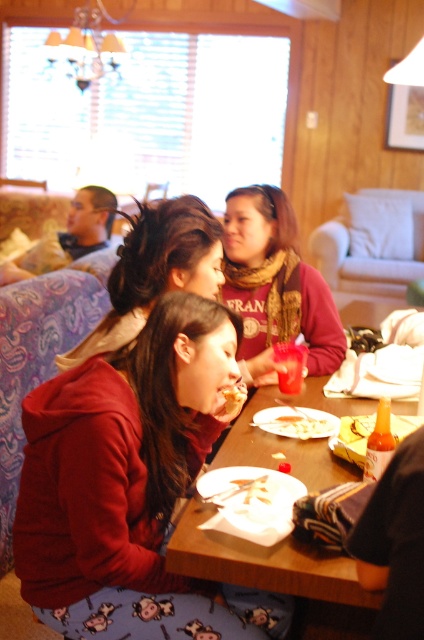
Is point (95, 614) less distant than point (281, 433)?

Yes, point (95, 614) is closer to viewer.

Does matte red hoodie at lower left appear on the right side of white matte pasta at table center?

No, matte red hoodie at lower left is not to the right of white matte pasta at table center.

Is point (113, 595) positioned behind point (310, 422)?

No.

At what (x,y) coordinates should I click in order to perform the action: click on matte red hoodie at lower left. Please return your answer as a coordinate pair (x, y). The width and height of the screenshot is (424, 640). Looking at the image, I should click on (131, 486).

Does matte red hoodie at lower left lie in front of wooden table at center?

No, it is behind wooden table at center.

Who is more distant from viewer, (265, 611) or (287, 540)?

The point (265, 611) is behind.

Locate an element on the screen. This screenshot has width=424, height=640. matte red hoodie at lower left is located at coordinates (131, 486).

Find the location of a particular element. matte red hoodie at lower left is located at coordinates (131, 486).

Does wooden table at center appear on the left side of golden crispy chicken at lower center?

In fact, wooden table at center is to the right of golden crispy chicken at lower center.

Identify the location of wooden table at center. The width and height of the screenshot is (424, 640). [x=264, y=563].

The height and width of the screenshot is (640, 424). What are the coordinates of `wooden table at center` in the screenshot? It's located at (264, 563).